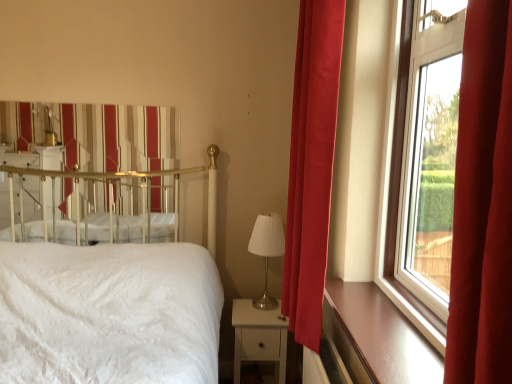
What are the coordinates of `silver metallic table lamp at center` in the screenshot? It's located at (267, 251).

This screenshot has width=512, height=384. What do you see at coordinates (377, 337) in the screenshot? I see `brown wood at right` at bounding box center [377, 337].

You are a GUI agent. You are given a task and a screenshot of the screen. Output one action in this format:
    pyautogui.click(x=<x>, y=<y>)
    Task: Click on the brown wood at right
    
    Given the screenshot: What is the action you would take?
    pyautogui.click(x=377, y=337)

Measure the distance between white textured bed at left and camera.

white textured bed at left is 4.90 feet from camera.

You are a GUI agent. You are given a task and a screenshot of the screen. Output one action in this format:
    pyautogui.click(x=<x>, y=<y>)
    Task: Click on the satin red curtain at right
    
    Given the screenshot: What is the action you would take?
    pyautogui.click(x=311, y=165)

You are a GUI agent. You are given a task and a screenshot of the screen. Output one action in this format:
    pyautogui.click(x=<x>, y=<y>)
    Task: Click on the silver metallic table lamp at center
    This screenshot has height=384, width=512.
    Given the screenshot: What is the action you would take?
    pyautogui.click(x=267, y=251)

Looking at this image, how different are the orientations of transparent glass window at right and satin red curtain at right in degrees?

1.4 degrees separate the facing orientations of transparent glass window at right and satin red curtain at right.

Would you say transparent glass window at right is to the left or to the right of satin red curtain at right in the picture?

transparent glass window at right is positioned on satin red curtain at right's right side.

Between transparent glass window at right and satin red curtain at right, which one has smaller width?

transparent glass window at right.

Who is smaller, transparent glass window at right or satin red curtain at right?

With smaller size is transparent glass window at right.

Is metallic gold canopy bed at upper left spatially inside white textured bed at left, or outside of it?

metallic gold canopy bed at upper left is not inside white textured bed at left, it's outside.

Is metallic gold canopy bed at upper left wider than white textured bed at left?

No, metallic gold canopy bed at upper left is not wider than white textured bed at left.

From the image's perspective, which one is positioned lower, metallic gold canopy bed at upper left or white textured bed at left?

white textured bed at left appears lower in the image.

Is point (140, 186) positioned behind point (176, 299)?

Yes, point (140, 186) is behind point (176, 299).

How far apart are transparent glass window at right and silver metallic table lamp at center?

32.78 inches.

Is silver metallic table lamp at center at the back of transparent glass window at right?

That's not correct — transparent glass window at right is not looking away from silver metallic table lamp at center.

In the image, is transparent glass window at right positioned in front of or behind silver metallic table lamp at center?

transparent glass window at right is positioned closer to the viewer than silver metallic table lamp at center.

From the image's perspective, is transparent glass window at right located above or below silver metallic table lamp at center?

transparent glass window at right is above silver metallic table lamp at center.

What's the angular difference between transparent glass window at right and white textured bed at left's facing directions?

The facing directions of transparent glass window at right and white textured bed at left are 91.3 degrees apart.

Is transparent glass window at right positioned with its back to white textured bed at left?

No, transparent glass window at right's orientation is not away from white textured bed at left.

Considering the points (409, 120) and (186, 344), which point is in front, point (409, 120) or point (186, 344)?

Point (409, 120)

Can you confirm if transparent glass window at right is bigger than white textured bed at left?

Actually, transparent glass window at right might be smaller than white textured bed at left.

Which of these two, white textured bed at left or satin red curtain at right, stands taller?

With more height is satin red curtain at right.

Considering the positions of objects white textured bed at left and satin red curtain at right in the image provided, who is more to the left, white textured bed at left or satin red curtain at right?

white textured bed at left.

Is white textured bed at left not inside satin red curtain at right?

Yes, white textured bed at left is outside of satin red curtain at right.

Is white textured bed at left turned away from satin red curtain at right?

No, white textured bed at left's orientation is not away from satin red curtain at right.

From the image's perspective, is white textured bed at left below silver metallic table lamp at center?

Yes, from the image's perspective, white textured bed at left is below silver metallic table lamp at center.

Does point (70, 334) appear closer or farther from the camera than point (267, 231)?

Point (70, 334) appears to be closer to the viewer than point (267, 231).

Locate an element on the screen. This screenshot has height=384, width=512. bed located below the silver metallic table lamp at center (from the image's perspective) is located at coordinates (106, 302).

Which of these two, white textured bed at left or silver metallic table lamp at center, is thinner?

silver metallic table lamp at center is thinner.

Consider the image. Is white textured bed at left beside brown wood at right?

They are not placed beside each other.

From the image's perspective, relative to brown wood at right, is white textured bed at left above or below?

white textured bed at left is below brown wood at right.

Is brown wood at right completely or partially inside white textured bed at left?

No, brown wood at right is not a part of white textured bed at left.

From a real-world perspective, is white textured bed at left beneath brown wood at right?

Yes, from a real-world perspective, white textured bed at left is below brown wood at right.

In the image, there is a transparent glass window at right. Where is `curtain below it (from the image's perspective)`? curtain below it (from the image's perspective) is located at coordinates (311, 165).

Identify the location of bed directly beneath the metallic gold canopy bed at upper left (from a real-world perspective). The height and width of the screenshot is (384, 512). (106, 302).

When comparing their distances from transparent glass window at right, does silver metallic table lamp at center or white textured bed at left seem further?

The object further to transparent glass window at right is white textured bed at left.

Based on their spatial positions, is white glossy nightstand at lower center or metallic gold canopy bed at upper left closer to brown wood at right?

The object closer to brown wood at right is white glossy nightstand at lower center.

Looking at the image, which one is located closer to white glossy nightstand at lower center, silver metallic table lamp at center or brown wood at right?

The object closer to white glossy nightstand at lower center is silver metallic table lamp at center.

Looking at the image, which one is located further to transparent glass window at right, white textured bed at left or metallic gold canopy bed at upper left?

Based on the image, metallic gold canopy bed at upper left appears to be further to transparent glass window at right.

From the image, which object appears to be nearer to brown wood at right, satin red curtain at right or white textured bed at left?

The object closer to brown wood at right is satin red curtain at right.

When comparing their distances from metallic gold canopy bed at upper left, does silver metallic table lamp at center or satin red curtain at right seem further?

satin red curtain at right is further to metallic gold canopy bed at upper left.

Looking at the image, which one is located further to silver metallic table lamp at center, metallic gold canopy bed at upper left or transparent glass window at right?

metallic gold canopy bed at upper left lies further to silver metallic table lamp at center than the other object.

Which object lies nearer to the anchor point silver metallic table lamp at center, white glossy nightstand at lower center or white textured bed at left?

The object closer to silver metallic table lamp at center is white glossy nightstand at lower center.

Find the location of a particular element. Image resolution: width=512 pixels, height=384 pixels. curtain situated between white textured bed at left and transparent glass window at right from left to right is located at coordinates (311, 165).

In order to click on window between white textured bed at left and silver metallic table lamp at center from front to back in this screenshot , I will do `click(476, 201)`.

Find the location of a particular element. curtain between brown wood at right and silver metallic table lamp at center in the front-back direction is located at coordinates (311, 165).

Where is `curtain located between transparent glass window at right and white glossy nightstand at lower center in the depth direction`? The image size is (512, 384). curtain located between transparent glass window at right and white glossy nightstand at lower center in the depth direction is located at coordinates (311, 165).